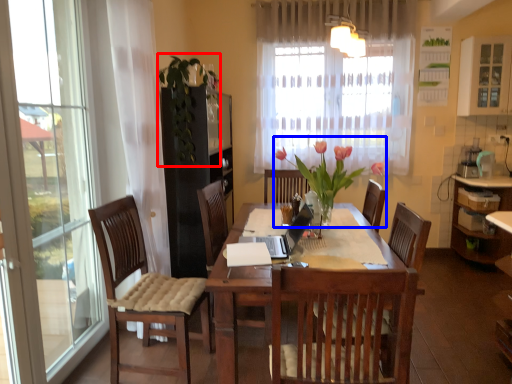
Question: Which of the following is the farthest to the observer, floral arrangement (highlighted by a red box) or floral arrangement (highlighted by a blue box)?

Choices:
 (A) floral arrangement
 (B) floral arrangement

Answer: (A)